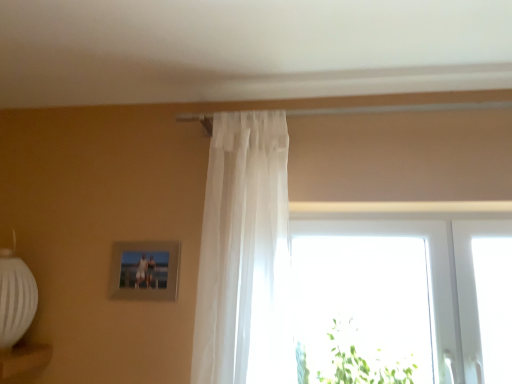
What do you see at coordinates (245, 256) in the screenshot?
I see `sheer white curtain at center` at bounding box center [245, 256].

Where is `transparent glass window at center`? This screenshot has width=512, height=384. transparent glass window at center is located at coordinates (406, 294).

The width and height of the screenshot is (512, 384). I want to click on sheer white curtain at center, so click(245, 256).

Is metallic silver picture frame at upper left located outside transparent glass window at center?

That's correct, metallic silver picture frame at upper left is outside of transparent glass window at center.

Who is bigger, metallic silver picture frame at upper left or transparent glass window at center?

transparent glass window at center is bigger.

Which point is more distant from viewer, (139, 291) or (467, 224)?

The point (467, 224) is behind.

Would you say metallic silver picture frame at upper left is a long distance from transparent glass window at center?

No, metallic silver picture frame at upper left is in close proximity to transparent glass window at center.

Is transparent glass window at center aimed at metallic silver picture frame at upper left?

No, transparent glass window at center is not oriented towards metallic silver picture frame at upper left.

Considering the positions of point (324, 355) and point (168, 248), is point (324, 355) closer or farther from the camera than point (168, 248)?

Point (324, 355) appears to be farther away from the viewer than point (168, 248).

Does transparent glass window at center contain metallic silver picture frame at upper left?

Actually, metallic silver picture frame at upper left is outside transparent glass window at center.

The image size is (512, 384). I want to click on window on the right of metallic silver picture frame at upper left, so 406,294.

Is sheer white curtain at center next to metallic silver picture frame at upper left?

There is a gap between sheer white curtain at center and metallic silver picture frame at upper left.

Can we say sheer white curtain at center lies outside metallic silver picture frame at upper left?

sheer white curtain at center is positioned outside metallic silver picture frame at upper left.

Which is behind, point (197, 301) or point (114, 251)?

The point (114, 251) is farther.

Consider the image. Is metallic silver picture frame at upper left spatially inside sheer white curtain at center, or outside of it?

The correct answer is: outside.

From a real-world perspective, is metallic silver picture frame at upper left above or below sheer white curtain at center?

In terms of real-world spatial position, metallic silver picture frame at upper left is below sheer white curtain at center.

In terms of width, does metallic silver picture frame at upper left look wider or thinner when compared to sheer white curtain at center?

Clearly, metallic silver picture frame at upper left has less width compared to sheer white curtain at center.

In the image, is green leafy plant at lower right positioned in front of or behind transparent glass window at center?

green leafy plant at lower right is positioned closer to the viewer than transparent glass window at center.

Which of these two, green leafy plant at lower right or transparent glass window at center, stands taller?

transparent glass window at center is taller.

Would you say green leafy plant at lower right is a long distance from transparent glass window at center?

No.

From a real-world perspective, between sheer white curtain at center and green leafy plant at lower right, who is vertically higher?

sheer white curtain at center, from a real-world perspective.

Is sheer white curtain at center to the left or to the right of green leafy plant at lower right in the image?

Based on their positions, sheer white curtain at center is located to the left of green leafy plant at lower right.

Can you tell me how much sheer white curtain at center and green leafy plant at lower right differ in facing direction?

They differ by 0.566 degrees in their facing directions.

From the image's perspective, which one is positioned lower, sheer white curtain at center or green leafy plant at lower right?

green leafy plant at lower right.

Is metallic silver picture frame at upper left facing away from green leafy plant at lower right?

No, metallic silver picture frame at upper left's orientation is not away from green leafy plant at lower right.

From the image's perspective, which object appears higher, metallic silver picture frame at upper left or green leafy plant at lower right?

metallic silver picture frame at upper left appears higher in the image.

In the scene shown: Is metallic silver picture frame at upper left taller than green leafy plant at lower right?

In fact, metallic silver picture frame at upper left may be shorter than green leafy plant at lower right.

Considering their positions, is metallic silver picture frame at upper left located in front of or behind green leafy plant at lower right?

metallic silver picture frame at upper left is behind green leafy plant at lower right.

Locate an element on the screen. picture frame that appears on the left of transparent glass window at center is located at coordinates (145, 271).

The width and height of the screenshot is (512, 384). I want to click on window on the right side of metallic silver picture frame at upper left, so click(x=406, y=294).

Looking at the image, which one is located closer to sheer white curtain at center, green leafy plant at lower right or metallic silver picture frame at upper left?

metallic silver picture frame at upper left.

From the image, which object appears to be farther from green leafy plant at lower right, metallic silver picture frame at upper left or transparent glass window at center?

metallic silver picture frame at upper left is positioned further to the anchor green leafy plant at lower right.

From the image, which object appears to be nearer to transparent glass window at center, green leafy plant at lower right or metallic silver picture frame at upper left?

green leafy plant at lower right.

From the image, which object appears to be farther from metallic silver picture frame at upper left, sheer white curtain at center or transparent glass window at center?

transparent glass window at center is further to metallic silver picture frame at upper left.

Based on their spatial positions, is metallic silver picture frame at upper left or green leafy plant at lower right further from transparent glass window at center?

Result: metallic silver picture frame at upper left is further to transparent glass window at center.

Based on their spatial positions, is transparent glass window at center or sheer white curtain at center closer to green leafy plant at lower right?

transparent glass window at center lies closer to green leafy plant at lower right than the other object.

Based on their spatial positions, is sheer white curtain at center or metallic silver picture frame at upper left further from green leafy plant at lower right?

The object further to green leafy plant at lower right is metallic silver picture frame at upper left.

Which object lies nearer to the anchor point metallic silver picture frame at upper left, green leafy plant at lower right or sheer white curtain at center?

sheer white curtain at center.

Locate an element on the screen. curtain between metallic silver picture frame at upper left and green leafy plant at lower right in the horizontal direction is located at coordinates (245, 256).

Where is `plant between sheer white curtain at center and transparent glass window at center`? This screenshot has width=512, height=384. plant between sheer white curtain at center and transparent glass window at center is located at coordinates (352, 357).

At what (x,y) coordinates should I click in order to perform the action: click on curtain located between metallic silver picture frame at upper left and transparent glass window at center in the left-right direction. Please return your answer as a coordinate pair (x, y). The image size is (512, 384). Looking at the image, I should click on (245, 256).

At what (x,y) coordinates should I click in order to perform the action: click on plant between metallic silver picture frame at upper left and transparent glass window at center from left to right. Please return your answer as a coordinate pair (x, y). The image size is (512, 384). Looking at the image, I should click on (352, 357).